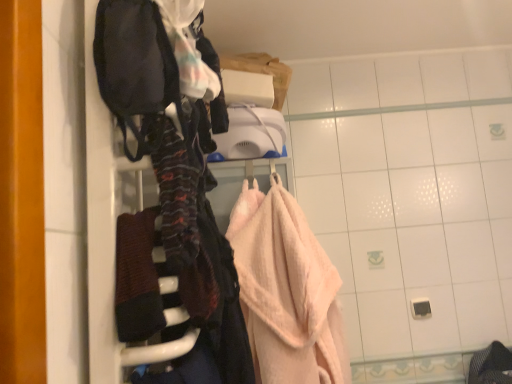
Question: From a real-world perspective, is dark brown textured towel at center under velvet dark bag at left?

Choices:
 (A) yes
 (B) no

Answer: (A)

Question: From the image's perspective, is dark brown textured towel at center located beneath velvet dark bag at left?

Choices:
 (A) no
 (B) yes

Answer: (B)

Question: Considering the relative positions of dark brown textured towel at center and velvet dark bag at left in the image provided, is dark brown textured towel at center to the right of velvet dark bag at left from the viewer's perspective?

Choices:
 (A) yes
 (B) no

Answer: (A)

Question: Considering the relative positions of dark brown textured towel at center and velvet dark bag at left in the image provided, is dark brown textured towel at center behind velvet dark bag at left?

Choices:
 (A) no
 (B) yes

Answer: (B)

Question: Is dark brown textured towel at center beside velvet dark bag at left?

Choices:
 (A) yes
 (B) no

Answer: (B)

Question: Would you say dark brown textured towel at center is to the left or to the right of pink terry cloth towel at center in the picture?

Choices:
 (A) left
 (B) right

Answer: (A)

Question: In terms of height, does dark brown textured towel at center look taller or shorter compared to pink terry cloth towel at center?

Choices:
 (A) short
 (B) tall

Answer: (A)

Question: In the image, is dark brown textured towel at center positioned in front of or behind pink terry cloth towel at center?

Choices:
 (A) behind
 (B) front

Answer: (B)

Question: From a real-world perspective, relative to pink terry cloth towel at center, is dark brown textured towel at center vertically above or below?

Choices:
 (A) above
 (B) below

Answer: (A)

Question: Looking at the image, does pink terry cloth towel at center seem bigger or smaller compared to dark brown textured towel at center?

Choices:
 (A) big
 (B) small

Answer: (A)

Question: From their relative heights in the image, would you say pink terry cloth towel at center is taller or shorter than dark brown textured towel at center?

Choices:
 (A) short
 (B) tall

Answer: (B)

Question: Considering their positions, is pink terry cloth towel at center located in front of or behind dark brown textured towel at center?

Choices:
 (A) front
 (B) behind

Answer: (B)

Question: Considering the positions of point (330, 362) and point (153, 228), is point (330, 362) closer or farther from the camera than point (153, 228)?

Choices:
 (A) closer
 (B) farther

Answer: (B)

Question: In terms of width, does dark brown textured towel at center look wider or thinner when compared to velvet dark bag at left?

Choices:
 (A) thin
 (B) wide

Answer: (A)

Question: From the image's perspective, relative to velvet dark bag at left, is dark brown textured towel at center above or below?

Choices:
 (A) above
 (B) below

Answer: (B)